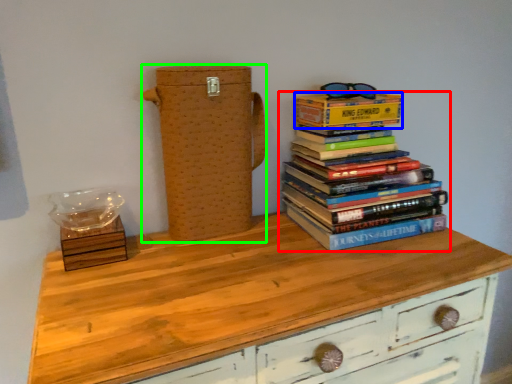
Question: Which object is positioned closest to book (highlighted by a red box)? Select from paperback book (highlighted by a blue box) and cardboard box (highlighted by a green box).

Choices:
 (A) paperback book
 (B) cardboard box

Answer: (A)